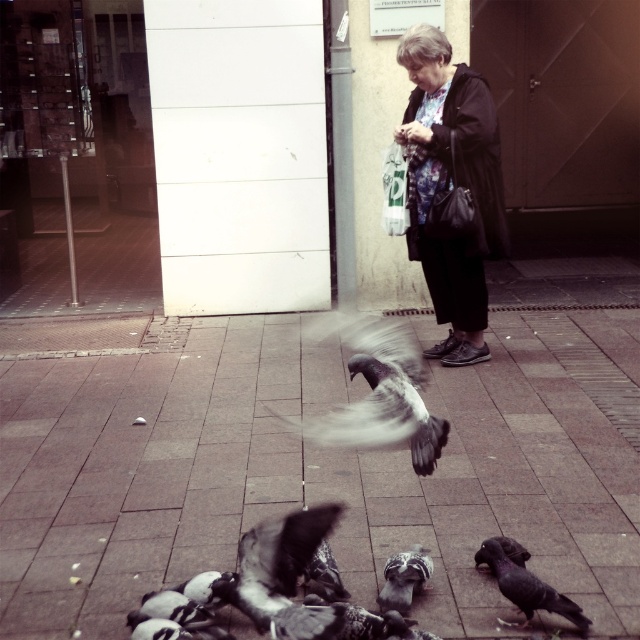
Question: In this image, where is floral fabric jacket at center located relative to black feathered pigeon at lower right?

Choices:
 (A) above
 (B) below

Answer: (A)

Question: Which point is farther from the camera taking this photo?

Choices:
 (A) (385, 388)
 (B) (516, 584)
 (C) (394, 584)
 (D) (561, 376)

Answer: (D)

Question: Considering the real-world distances, which object is closest to the gray feathered pigeon at lower center?

Choices:
 (A) black feathered pigeon at lower right
 (B) floral fabric jacket at center
 (C) gray feathered bird at center
 (D) brick pavement at center

Answer: (A)

Question: Estimate the real-world distances between objects in this image. Which object is farther from the gray feathered bird at center?

Choices:
 (A) floral fabric jacket at center
 (B) gray feathered pigeon at lower center
 (C) black feathered pigeon at lower right

Answer: (A)

Question: Is floral fabric jacket at center to the left of gray feathered bird at center from the viewer's perspective?

Choices:
 (A) yes
 (B) no

Answer: (B)

Question: Is the position of brick pavement at center less distant than that of gray feathered bird at center?

Choices:
 (A) no
 (B) yes

Answer: (A)